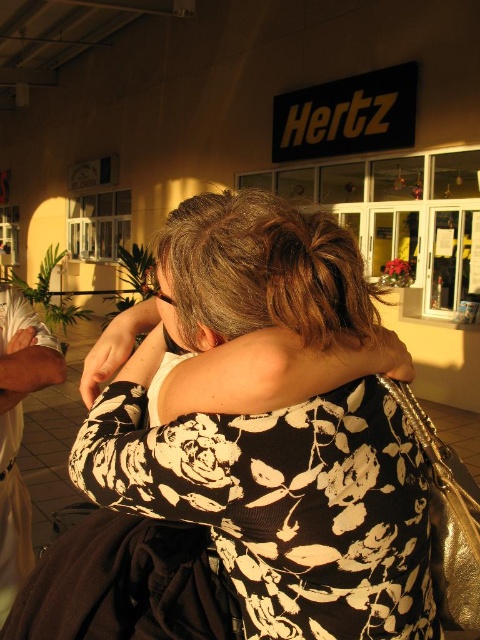
Question: Which of the following is the closest to the observer?

Choices:
 (A) (226, 236)
 (B) (22, 548)

Answer: (A)

Question: Does black floral dress at center appear under white fabric at left?

Choices:
 (A) no
 (B) yes

Answer: (A)

Question: Which point is farther to the camera?

Choices:
 (A) (210, 253)
 (B) (0, 624)

Answer: (B)

Question: Can you confirm if black floral dress at center is positioned to the left of white fabric at left?

Choices:
 (A) yes
 (B) no

Answer: (B)

Question: Which object is closer to the camera taking this photo?

Choices:
 (A) black floral dress at center
 (B) white fabric at left

Answer: (A)

Question: Is black floral dress at center thinner than white fabric at left?

Choices:
 (A) no
 (B) yes

Answer: (A)